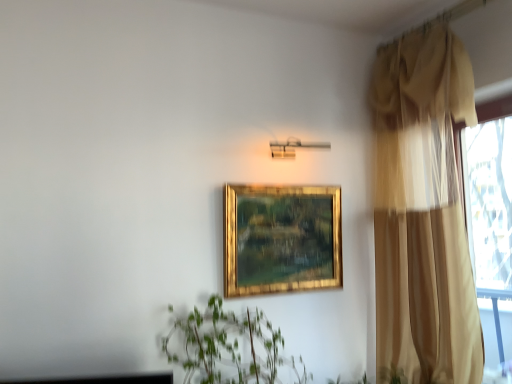
You are a GUI agent. You are given a task and a screenshot of the screen. Output one action in this format:
    pyautogui.click(x=<x>, y=<y>)
    Task: Click on the beige sheer curtain at right
    
    Given the screenshot: What is the action you would take?
    pyautogui.click(x=422, y=212)

The image size is (512, 384). What do you see at coordinates (422, 212) in the screenshot? I see `beige sheer curtain at right` at bounding box center [422, 212].

Describe the element at coordinates (281, 239) in the screenshot. The image size is (512, 384). I see `gold/gilded picture frame at center` at that location.

Find the location of a particular element. The width and height of the screenshot is (512, 384). gold/gilded picture frame at center is located at coordinates (281, 239).

Measure the distance between point (246, 273) and camera.

1.86 meters.

Where is `beige sheer curtain at right`? Image resolution: width=512 pixels, height=384 pixels. beige sheer curtain at right is located at coordinates (422, 212).

Considering the relative positions of beige sheer curtain at right and gold/gilded picture frame at center in the image provided, is beige sheer curtain at right to the left of gold/gilded picture frame at center from the viewer's perspective?

In fact, beige sheer curtain at right is to the right of gold/gilded picture frame at center.

Between beige sheer curtain at right and gold/gilded picture frame at center, which one is positioned behind?

gold/gilded picture frame at center is further from the camera.

Is point (419, 144) closer or farther from the camera than point (255, 294)?

Point (419, 144) is farther from the camera than point (255, 294).

From the image's perspective, is beige sheer curtain at right over gold/gilded picture frame at center?

Yes, from the image's perspective, beige sheer curtain at right is over gold/gilded picture frame at center.

From a real-world perspective, which is physically below, beige sheer curtain at right or gold/gilded picture frame at center?

From a 3D spatial view, gold/gilded picture frame at center is below.

Is beige sheer curtain at right thinner than gold/gilded picture frame at center?

No, beige sheer curtain at right is not thinner than gold/gilded picture frame at center.

Can you confirm if beige sheer curtain at right is shorter than gold/gilded picture frame at center?

No.

Which of these two, beige sheer curtain at right or gold/gilded picture frame at center, is bigger?

Bigger between the two is beige sheer curtain at right.

Is beige sheer curtain at right inside or outside of gold/gilded picture frame at center?

beige sheer curtain at right exists outside the volume of gold/gilded picture frame at center.

Is beige sheer curtain at right in contact with gold/gilded picture frame at center?

There is a gap between beige sheer curtain at right and gold/gilded picture frame at center.

Looking at this image, could you tell me if beige sheer curtain at right is turned towards gold/gilded picture frame at center?

Yes, beige sheer curtain at right is aimed at gold/gilded picture frame at center.

From the picture: How different are the orientations of beige sheer curtain at right and gold/gilded picture frame at center in degrees?

There is a 90.5-degree angle between the facing directions of beige sheer curtain at right and gold/gilded picture frame at center.

Where is `picture frame lying on the left of beige sheer curtain at right`? Image resolution: width=512 pixels, height=384 pixels. picture frame lying on the left of beige sheer curtain at right is located at coordinates (281, 239).

Does gold/gilded picture frame at center appear on the right side of beige sheer curtain at right?

In fact, gold/gilded picture frame at center is to the left of beige sheer curtain at right.

Between gold/gilded picture frame at center and beige sheer curtain at right, which one is positioned behind?

gold/gilded picture frame at center is further away from the camera.

Which is nearer, [229,216] or [449,165]?

The point [229,216] is in front.

From the image's perspective, is gold/gilded picture frame at center positioned above or below beige sheer curtain at right?

Based on their image positions, gold/gilded picture frame at center is located beneath beige sheer curtain at right.

From a real-world perspective, is gold/gilded picture frame at center physically located above or below beige sheer curtain at right?

From a real-world perspective, gold/gilded picture frame at center is physically below beige sheer curtain at right.

Which object is thinner, gold/gilded picture frame at center or beige sheer curtain at right?

With smaller width is gold/gilded picture frame at center.

Considering the sizes of objects gold/gilded picture frame at center and beige sheer curtain at right in the image provided, who is shorter, gold/gilded picture frame at center or beige sheer curtain at right?

gold/gilded picture frame at center is shorter.

Which of these two, gold/gilded picture frame at center or beige sheer curtain at right, is smaller?

gold/gilded picture frame at center.

Is gold/gilded picture frame at center spatially inside beige sheer curtain at right, or outside of it?

gold/gilded picture frame at center exists outside the volume of beige sheer curtain at right.

Is gold/gilded picture frame at center in contact with beige sheer curtain at right?

No, gold/gilded picture frame at center is not next to beige sheer curtain at right.

Could you tell me if gold/gilded picture frame at center is turned towards beige sheer curtain at right?

No, gold/gilded picture frame at center is not aimed at beige sheer curtain at right.

Measure the distance between gold/gilded picture frame at center and beige sheer curtain at right.

A distance of 19.56 inches exists between gold/gilded picture frame at center and beige sheer curtain at right.

Locate an element on the screen. curtain in front of the gold/gilded picture frame at center is located at coordinates (422, 212).

The height and width of the screenshot is (384, 512). I want to click on picture frame behind the beige sheer curtain at right, so click(281, 239).

Locate an element on the screen. curtain in front of the gold/gilded picture frame at center is located at coordinates (422, 212).